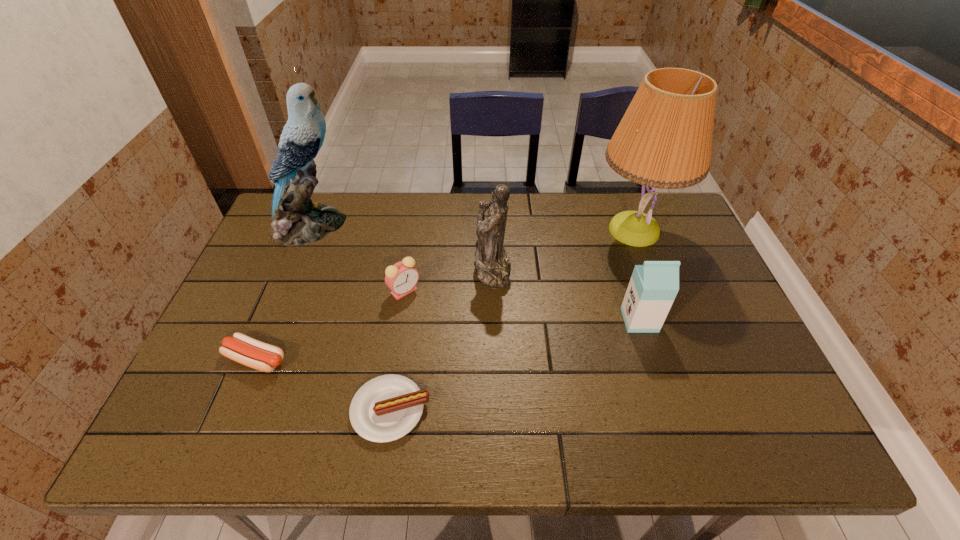
This screenshot has width=960, height=540. Identify the location of lamp. (664, 140).

In order to click on parakeet in this screenshot , I will do `click(296, 220)`.

Where is `figurine`? figurine is located at coordinates (493, 266).

Locate an element on the screen. This screenshot has width=960, height=540. the third object from right to left is located at coordinates (493, 266).

Identify the location of the fourth tallest object. This screenshot has width=960, height=540. (653, 286).

The height and width of the screenshot is (540, 960). I want to click on the third nearest object, so click(653, 286).

Identify the location of the fifth tallest object. Image resolution: width=960 pixels, height=540 pixels. (401, 278).

Where is `the left sausage`? This screenshot has width=960, height=540. the left sausage is located at coordinates (243, 349).

Locate an element on the screen. The image size is (960, 540). the second shortest object is located at coordinates (243, 349).

At what (x,y) coordinates should I click in order to perform the action: click on the right sausage. Please return your answer as a coordinate pair (x, y). The height and width of the screenshot is (540, 960). Looking at the image, I should click on (386, 408).